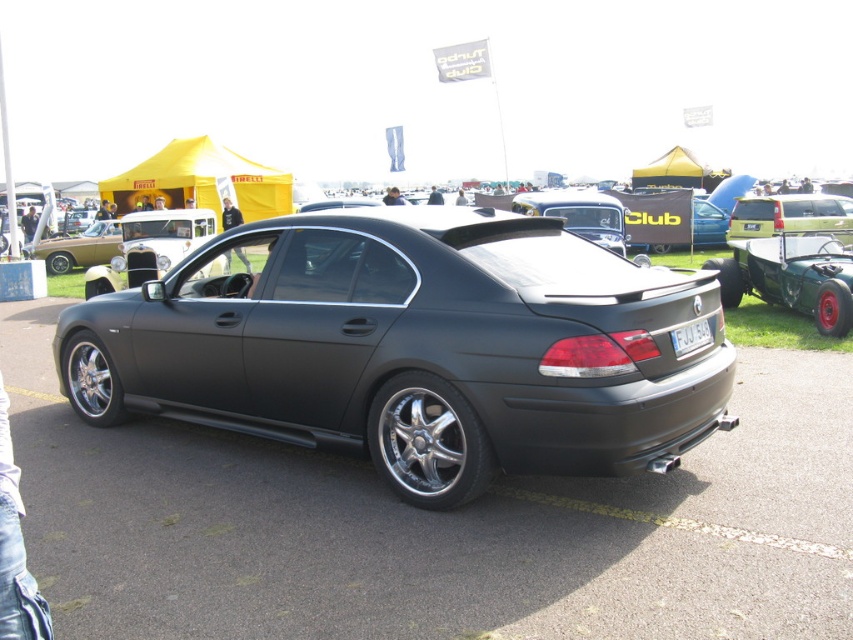
You are standing at the center of the car show. You want to take a photo of the matte black car at center. In which direction should you move to get a clear shot of the car?

Since the matte black car at center is located at point [415,348], you should move towards the center of the car show to get a clear shot of the car.

You are standing in front of the BMW sedan at the car show. There are two points marked on the car. The first point is at coordinate point (294, 355) and the second point is at coordinate point (781, 218). Which point appears closer to you?

Point (294, 355) is closer to the viewer than point (781, 218).

You are standing at the center of the car show and see the point marked at coordinate (792, 216). Which car is located at that point?

The point at coordinate (792, 216) indicates the matte black car at right.